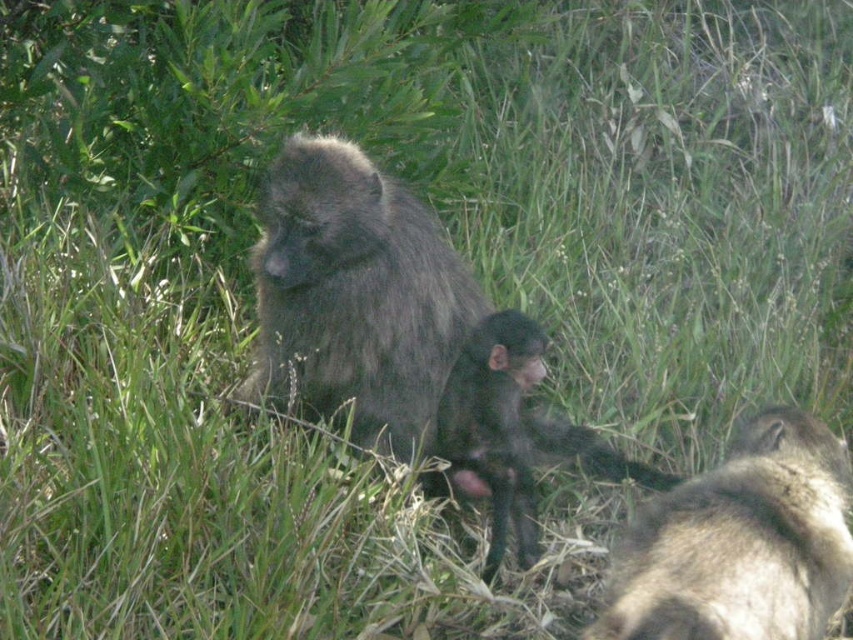
Is fuzzy brown monkey at lower right closer to the viewer compared to shiny black monkey at center?

Yes, fuzzy brown monkey at lower right is in front of shiny black monkey at center.

Find the location of `fuzzy brown monkey at lower right`. fuzzy brown monkey at lower right is located at coordinates (740, 541).

Does dark gray fur monkey at center appear on the right side of fuzzy brown monkey at lower right?

Incorrect, dark gray fur monkey at center is not on the right side of fuzzy brown monkey at lower right.

In the scene shown: Between dark gray fur monkey at center and fuzzy brown monkey at lower right, which one is positioned lower?

fuzzy brown monkey at lower right is lower down.

Who is more distant from viewer, (260, 317) or (772, 422)?

The point (260, 317) is more distant.

Find the location of `dark gray fur monkey at center`. dark gray fur monkey at center is located at coordinates (355, 296).

Between dark gray fur monkey at center and shiny black monkey at center, which one is positioned higher?

dark gray fur monkey at center is higher up.

Does point (389, 300) lie in front of point (535, 458)?

Yes, point (389, 300) is closer to viewer.

Locate an element on the screen. The image size is (853, 640). dark gray fur monkey at center is located at coordinates (355, 296).